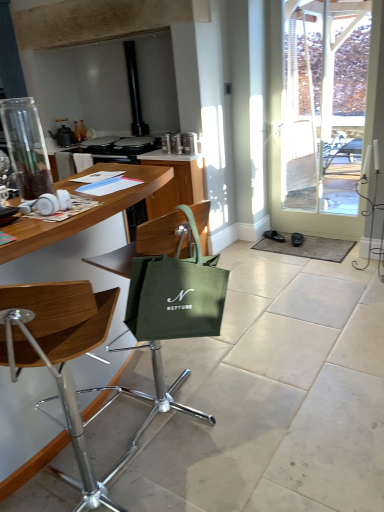
You are a GUI agent. You are given a task and a screenshot of the screen. Output one action in this format:
    pyautogui.click(x=<x>, y=<y>)
    Task: Click on the free spot in front of black leather shoe at lower right, the 2th footwear positioned from the right
    
    Given the screenshot: What is the action you would take?
    (277, 248)